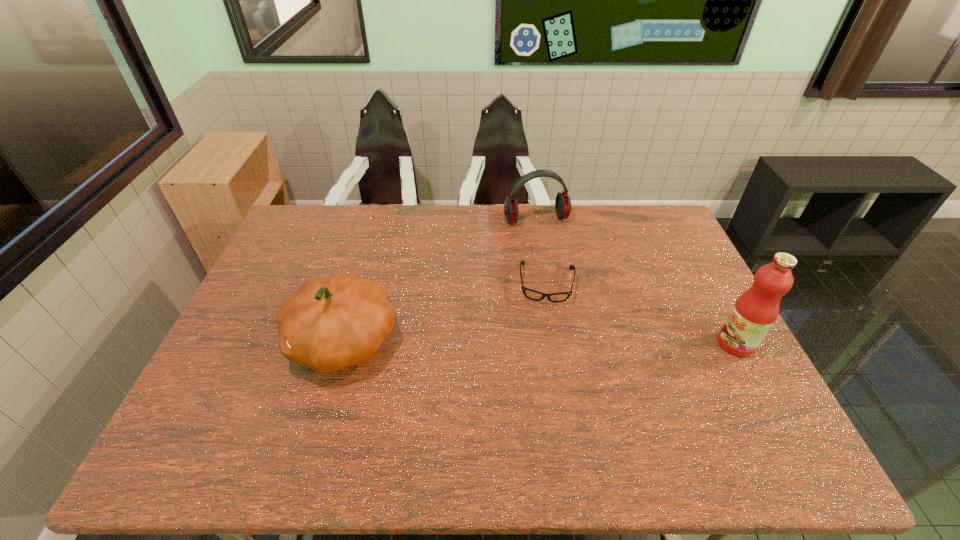
Where is `vacant space on the desktop that is between the pumpkin and the rightmost object and is positioned on the ear cups of the earphone`? The width and height of the screenshot is (960, 540). vacant space on the desktop that is between the pumpkin and the rightmost object and is positioned on the ear cups of the earphone is located at coordinates (584, 343).

Image resolution: width=960 pixels, height=540 pixels. Identify the location of vacant space on the desktop that is between the pumpkin and the rightmost object and is positioned on the front-facing side of the spectacles. (544, 342).